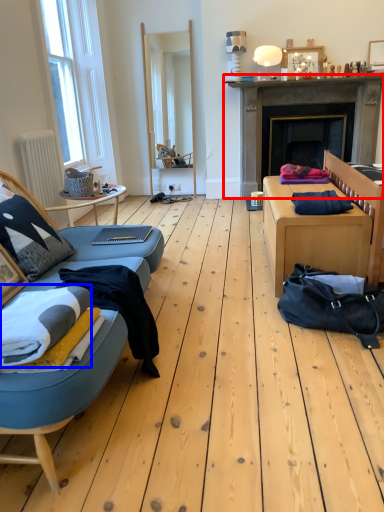
Question: Among these objects, which one is nearest to the camera, fireplace (highlighted by a red box) or blanket (highlighted by a blue box)?

Choices:
 (A) fireplace
 (B) blanket

Answer: (B)